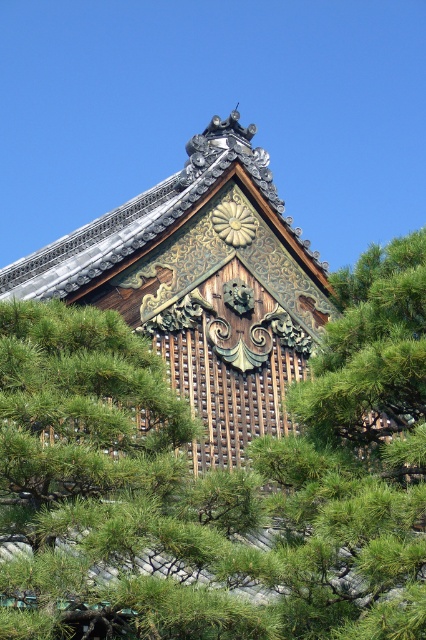
Question: Can you confirm if green textured pine tree at center is positioned above gold/ornate wood at upper center?

Choices:
 (A) yes
 (B) no

Answer: (B)

Question: Is green textured pine tree at center closer to camera compared to gold/ornate wood at upper center?

Choices:
 (A) no
 (B) yes

Answer: (B)

Question: Which of the following is the farthest from the observer?

Choices:
 (A) green textured pine tree at center
 (B) gold/ornate wood at upper center

Answer: (B)

Question: Which point appears closest to the camera in this image?

Choices:
 (A) (261, 161)
 (B) (423, 467)

Answer: (B)

Question: Does green textured pine tree at center have a greater width compared to gold/ornate wood at upper center?

Choices:
 (A) yes
 (B) no

Answer: (B)